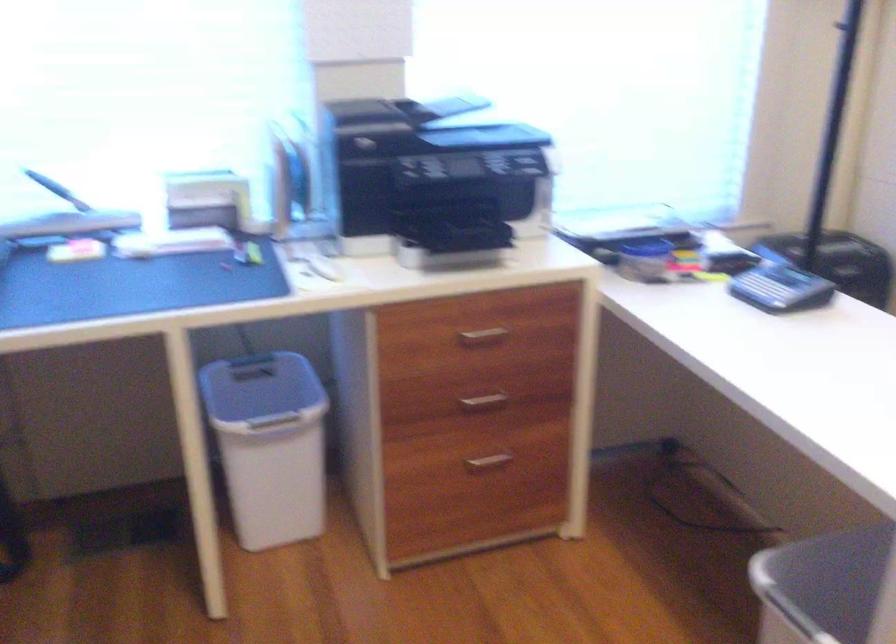
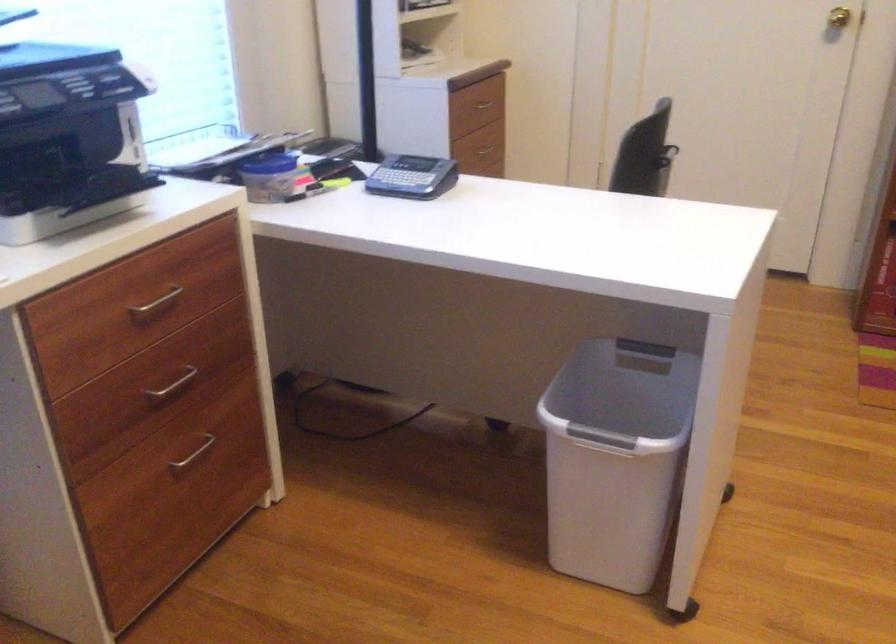
Locate, in the second image, the point that corresponds to (641,248) in the first image.

(270, 164)